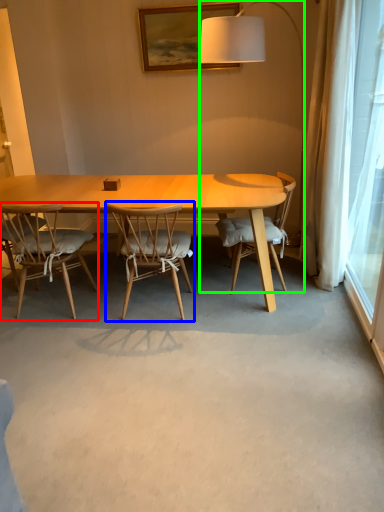
Question: Considering the real-world distances, which object is closest to chair (highlighted by a red box)? chair (highlighted by a blue box) or lamp (highlighted by a green box).

Choices:
 (A) chair
 (B) lamp

Answer: (A)